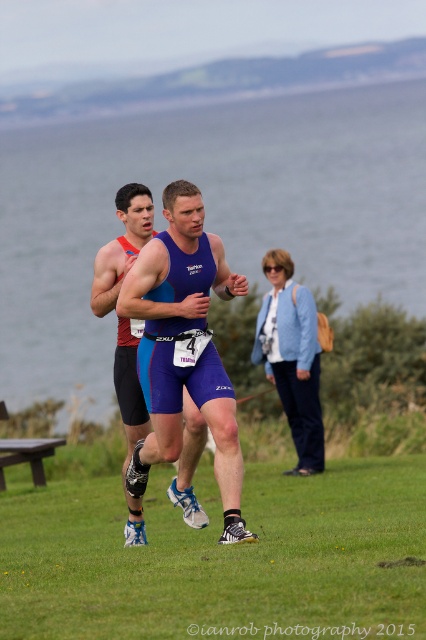
Question: Among these objects, which one is farthest from the camera?

Choices:
 (A) transparent water at center
 (B) blue matte triathlon suit at center
 (C) blue fabric tank top at center
 (D) green grass at lower center

Answer: (C)

Question: Is transparent water at center to the left of blue fabric tank top at center from the viewer's perspective?

Choices:
 (A) yes
 (B) no

Answer: (A)

Question: In this image, where is transparent water at center located relative to blue fabric tank top at center?

Choices:
 (A) right
 (B) left

Answer: (B)

Question: In this image, where is transparent water at center located relative to green grass at lower center?

Choices:
 (A) left
 (B) right

Answer: (A)

Question: Which object appears farthest from the camera in this image?

Choices:
 (A) transparent water at center
 (B) green grass at lower center
 (C) blue fabric tank top at center

Answer: (C)

Question: Among these objects, which one is nearest to the camera?

Choices:
 (A) green grass at lower center
 (B) blue fabric tank top at center

Answer: (A)